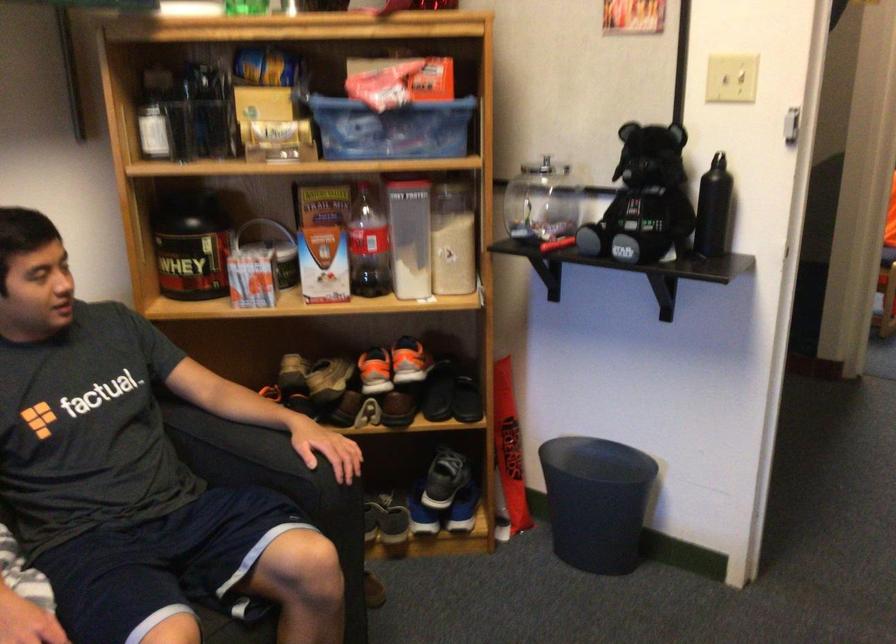
Where would you twist the red bottle cap? Please return your answer as a coordinate pair (x, y).

(405, 178)